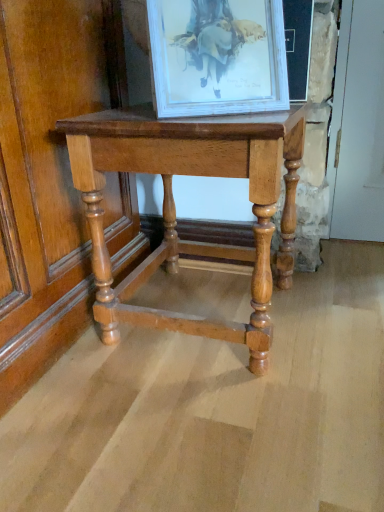
This screenshot has height=512, width=384. Identify the location of free region under polished wood table at center (from a real-world perspective). (193, 309).